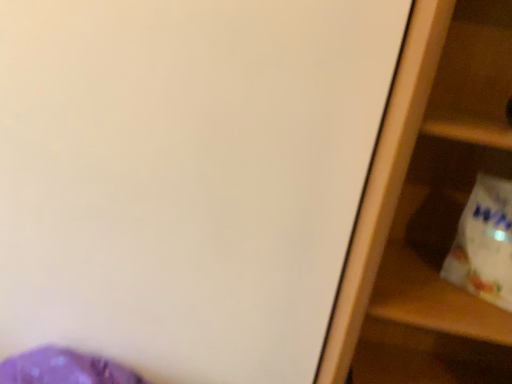
Question: Is white plastic grocery bag at right to the left or to the right of wooden shelf at right in the image?

Choices:
 (A) right
 (B) left

Answer: (A)

Question: Looking at their shapes, would you say white plastic grocery bag at right is wider or thinner than wooden shelf at right?

Choices:
 (A) thin
 (B) wide

Answer: (A)

Question: Is white plastic grocery bag at right spatially inside wooden shelf at right, or outside of it?

Choices:
 (A) inside
 (B) outside

Answer: (A)

Question: Is wooden shelf at right in front of or behind white plastic grocery bag at right in the image?

Choices:
 (A) behind
 (B) front

Answer: (B)

Question: From a real-world perspective, is wooden shelf at right positioned above or below white plastic grocery bag at right?

Choices:
 (A) above
 (B) below

Answer: (B)

Question: From the image's perspective, is wooden shelf at right located above or below white plastic grocery bag at right?

Choices:
 (A) below
 (B) above

Answer: (A)

Question: Looking at the image, does wooden shelf at right seem bigger or smaller compared to white plastic grocery bag at right?

Choices:
 (A) big
 (B) small

Answer: (A)